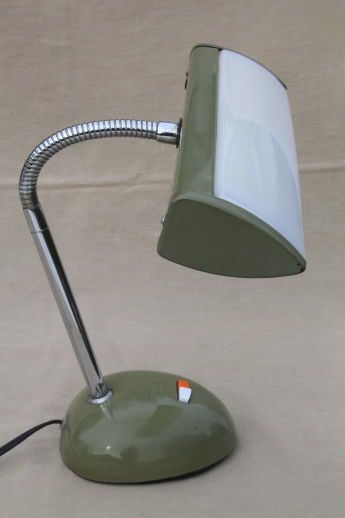
This screenshot has height=518, width=345. I want to click on plastic cover, so click(241, 171).